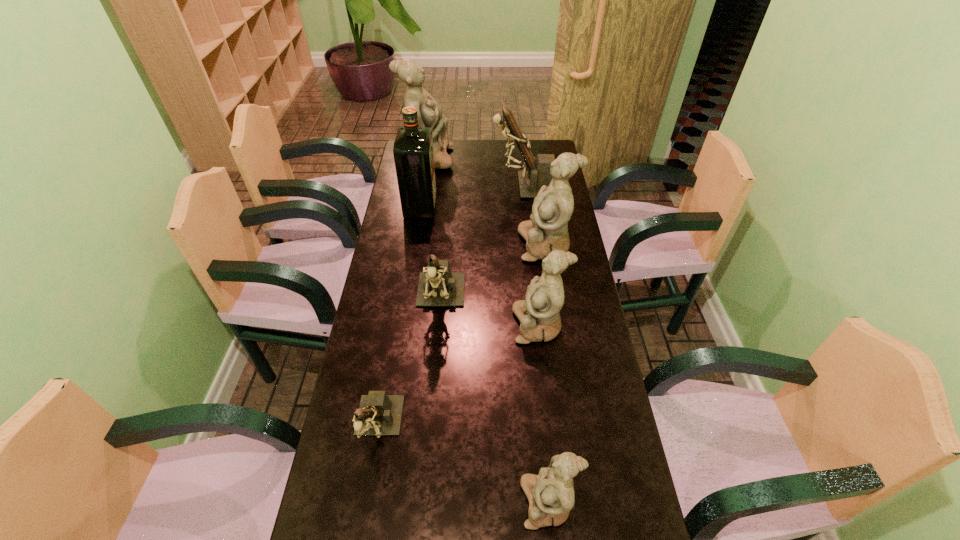
Locate an element on the screen. vacant space located on the front-facing side of the farthest brown figurine is located at coordinates (475, 185).

Where is `vacant space located on the front-facing side of the second farthest brown figurine`? vacant space located on the front-facing side of the second farthest brown figurine is located at coordinates (436, 349).

Image resolution: width=960 pixels, height=540 pixels. I want to click on vacant space situated 0.390m on the front-facing side of the third biggest white figurine, so click(x=388, y=325).

Identify the location of blank area located on the front-facing side of the third biggest white figurine. (462, 325).

I want to click on vacant space positioned on the front-facing side of the third biggest white figurine, so click(443, 325).

Find the location of `vacant space located on the front-facing side of the nearest object`. vacant space located on the front-facing side of the nearest object is located at coordinates (400, 502).

Locate an element on the screen. The width and height of the screenshot is (960, 540). vacant space situated 0.320m on the front-facing side of the nearest object is located at coordinates (x=383, y=502).

Identify the location of blank space located on the front-facing side of the nearest object. (447, 502).

You are a GUI agent. You are given a task and a screenshot of the screen. Output one action in this format:
    pyautogui.click(x=<x>, y=<y>)
    Task: Click on the object at the far edge
    
    Given the screenshot: What is the action you would take?
    pyautogui.click(x=429, y=112)

You are a GUI agent. You are given a task and a screenshot of the screen. Output one action in this format:
    pyautogui.click(x=<x>, y=<y>)
    Task: Click on the liquor that is at the left edge
    Image resolution: width=960 pixels, height=540 pixels.
    Given the screenshot: What is the action you would take?
    pyautogui.click(x=413, y=152)